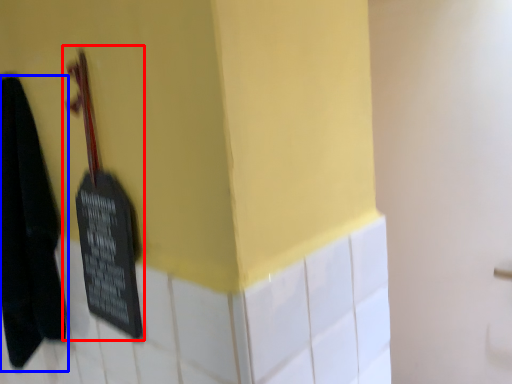
Question: Which point is further to the camera, violin (highlighted by a red box) or towel (highlighted by a blue box)?

Choices:
 (A) violin
 (B) towel

Answer: (B)